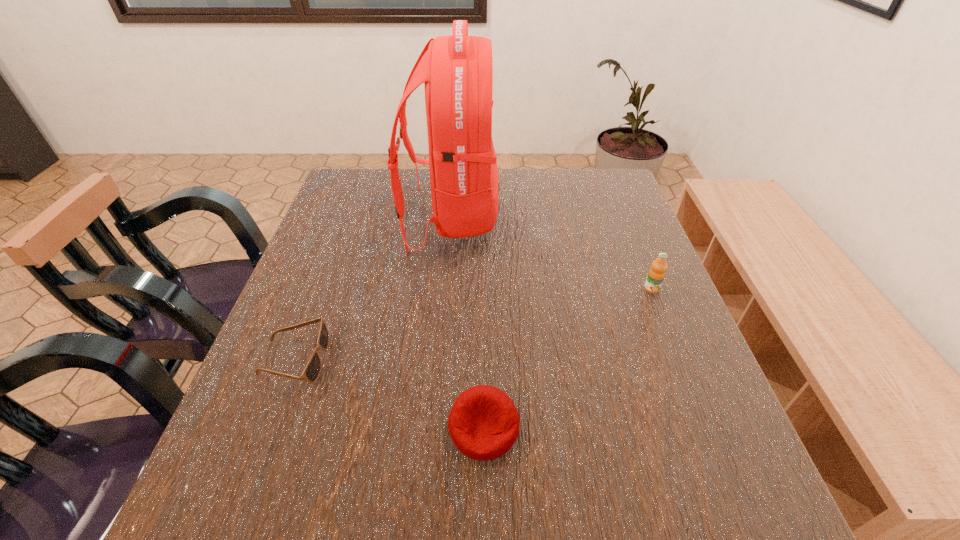
Where is `vacant space situated on the seat area of the nearest object`? vacant space situated on the seat area of the nearest object is located at coordinates coord(484,494).

Find the location of a particular element. The height and width of the screenshot is (540, 960). vacant space located 0.120m on the frames of the leftmost object is located at coordinates tap(386, 360).

Where is `object that is positioned at the far edge`? This screenshot has width=960, height=540. object that is positioned at the far edge is located at coordinates (457, 71).

Identify the location of object that is at the left edge. (312, 370).

At what (x,y) coordinates should I click in order to perform the action: click on object that is at the right edge. Please return your answer as a coordinate pair (x, y). This screenshot has height=540, width=960. Looking at the image, I should click on (656, 274).

Identify the location of blank space at the far edge of the desktop. (508, 208).

Identify the location of vacant position at the left edge of the desktop. Image resolution: width=960 pixels, height=540 pixels. (328, 236).

Where is `free space at the right edge`? This screenshot has height=540, width=960. free space at the right edge is located at coordinates (612, 289).

You are a GUI agent. You are given a task and a screenshot of the screen. Output one action in this format:
    pyautogui.click(x=<x>, y=<y>)
    Task: Click on the vacant space at the near left corner of the desktop
    
    Given the screenshot: What is the action you would take?
    pyautogui.click(x=246, y=495)

I want to click on vacant space at the far right corner of the desktop, so click(588, 177).